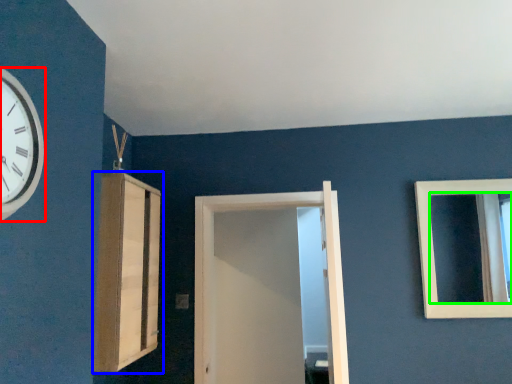
Question: Considering the real-world distances, which object is closest to wall clock (highlighted by a red box)? cabinetry (highlighted by a blue box) or mirror (highlighted by a green box).

Choices:
 (A) cabinetry
 (B) mirror

Answer: (A)